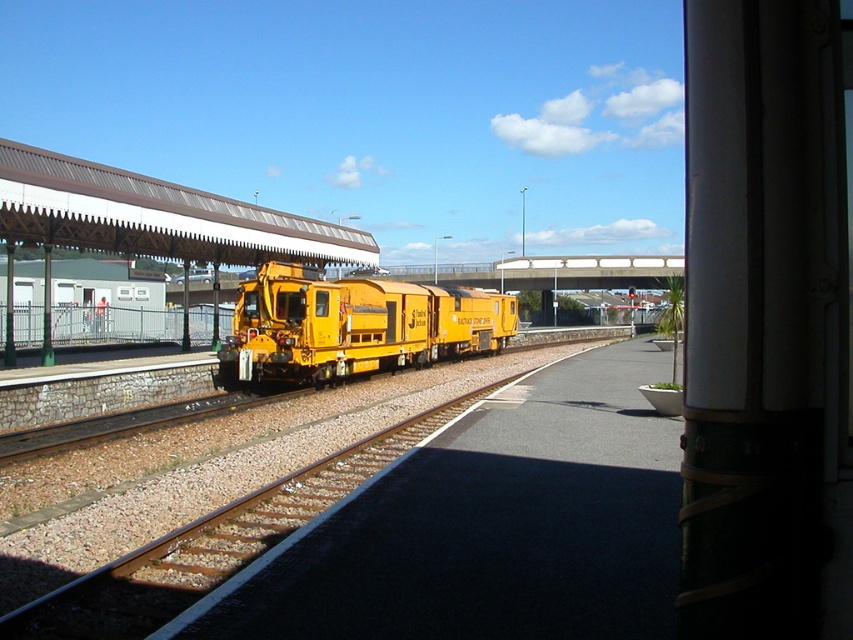
How far apart are yellow metal train track at center and yellow matte train at center?

yellow metal train track at center is 10.92 meters from yellow matte train at center.

The width and height of the screenshot is (853, 640). Identify the location of yellow metal train track at center. (225, 538).

I want to click on yellow metal train track at center, so click(225, 538).